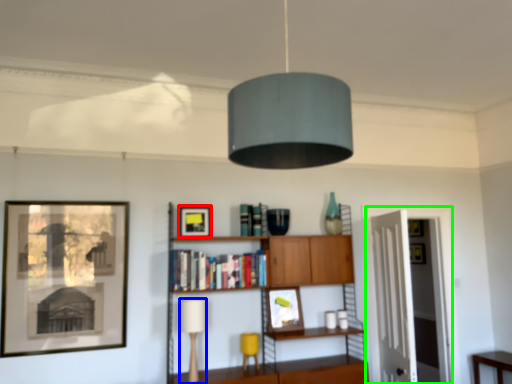
Question: Considering the real-world distances, which object is farthest from picture frame (highlighted by a red box)? table lamp (highlighted by a blue box) or glass door (highlighted by a green box)?

Choices:
 (A) table lamp
 (B) glass door

Answer: (B)